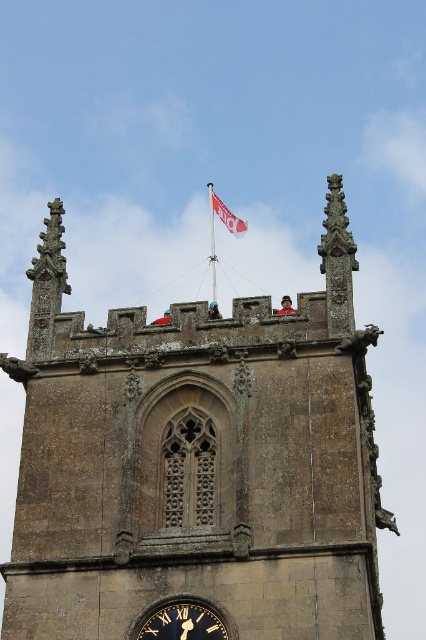
Based on the photo, you are standing in front of the historic stone tower and want to take a photo of the brown stone church at upper center. Based on its position, which direction should you face to ensure it is centered in your camera view?

The brown stone church at upper center is located at point coordinates, so you should face directly towards the upper center of the tower to center it in your camera view.

You are standing in front of the historic stone tower and want to determine the relative positions of two points marked on the tower. Which point is nearer to you, point (187, 636) or point (224, 221)?

Point (187, 636) is closer to the viewer than point (224, 221).